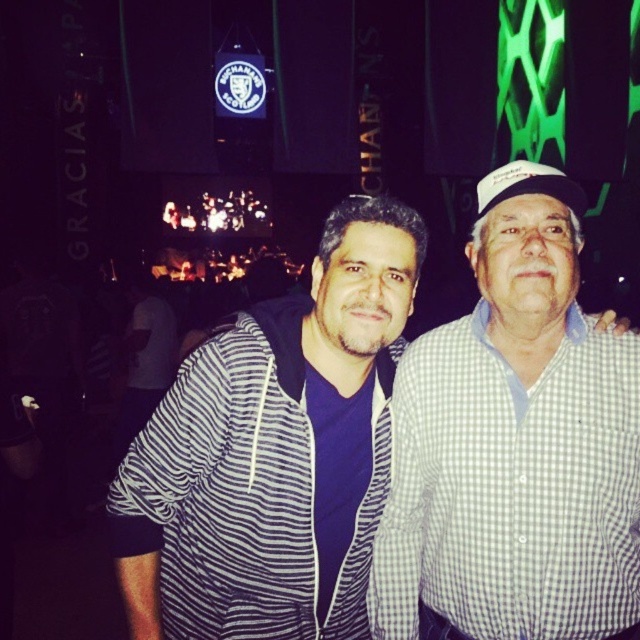
Can you confirm if striped fabric shirt at center is smaller than white fabric baseball cap at upper right?

Yes, striped fabric shirt at center is smaller than white fabric baseball cap at upper right.

From the picture: Is striped fabric shirt at center above white fabric baseball cap at upper right?

Actually, striped fabric shirt at center is below white fabric baseball cap at upper right.

Is point (291, 376) closer to viewer compared to point (502, 188)?

Yes, point (291, 376) is closer to viewer.

Locate an element on the screen. This screenshot has width=640, height=640. striped fabric shirt at center is located at coordinates (244, 490).

Who is more distant from viewer, (147, 532) or (561, 369)?

The point (561, 369) is more distant.

Is point (342, 461) closer to viewer compared to point (579, 554)?

No, it is not.

Does point (236, 330) come behind point (426, 360)?

No, it is not.

Identify the location of striped hoodie at center. This screenshot has height=640, width=640. (275, 451).

Is striped hoodie at center thinner than striped fabric shirt at center?

No.

Can you confirm if striped hoodie at center is taller than striped fabric shirt at center?

Yes.

Which is in front, point (278, 376) or point (260, 460)?

Point (260, 460) is in front.

Image resolution: width=640 pixels, height=640 pixels. Identify the location of striped hoodie at center. (275, 451).